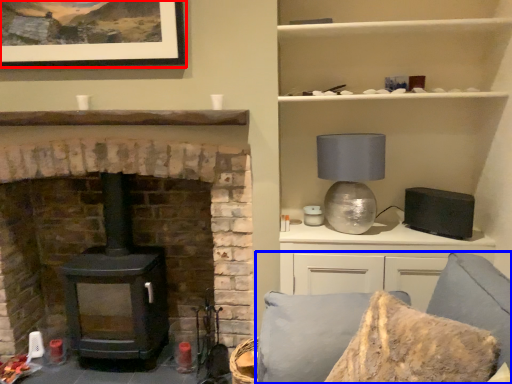
Question: Which of the following is the farthest to the observer, picture frame (highlighted by a red box) or couch (highlighted by a blue box)?

Choices:
 (A) picture frame
 (B) couch

Answer: (A)